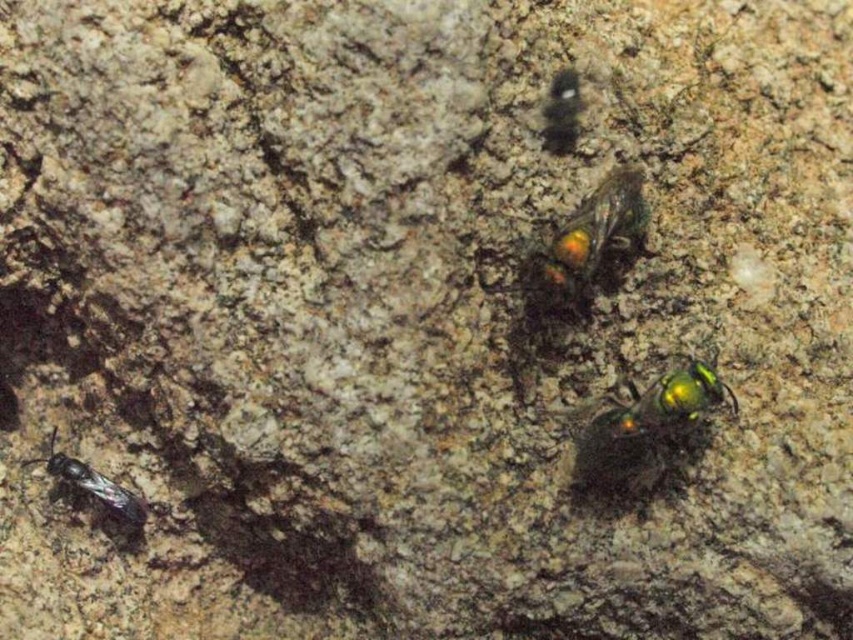
Question: Which object is the closest to the shiny metallic bee at lower left?

Choices:
 (A) metallic green beetle at center
 (B) metallic green bee at center

Answer: (A)

Question: Among these objects, which one is farthest from the camera?

Choices:
 (A) shiny metallic bee at lower left
 (B) metallic green beetle at center
 (C) metallic green bee at center

Answer: (A)

Question: Can you confirm if metallic green bee at center is positioned above shiny metallic bee at lower left?

Choices:
 (A) no
 (B) yes

Answer: (B)

Question: Which point is closer to the camera taking this photo?

Choices:
 (A) (575, 298)
 (B) (131, 499)
 (C) (628, 460)

Answer: (C)

Question: Is the position of metallic green beetle at center less distant than that of shiny metallic bee at lower left?

Choices:
 (A) yes
 (B) no

Answer: (A)

Question: Is metallic green beetle at center below shiny metallic bee at lower left?

Choices:
 (A) no
 (B) yes

Answer: (A)